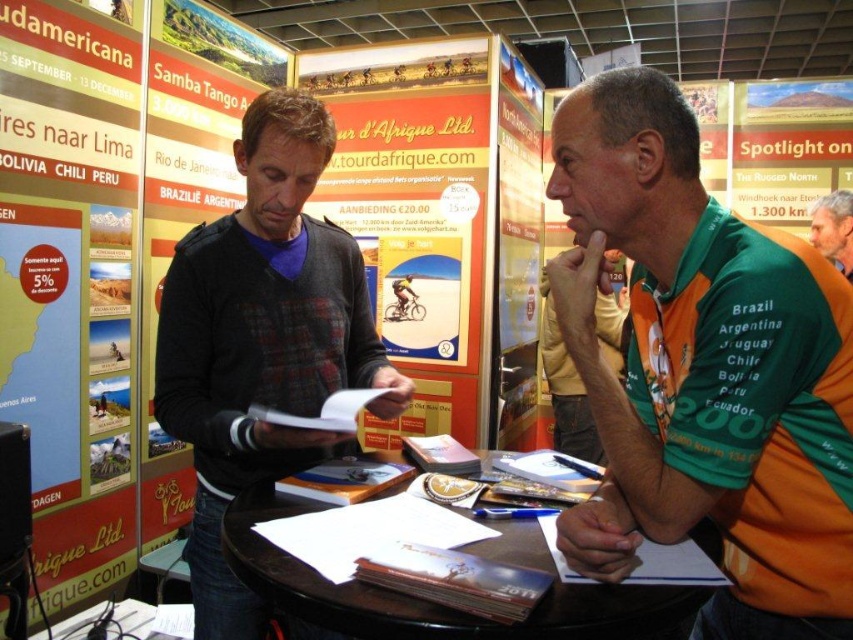
Question: From the image, what is the correct spatial relationship of green jersey at center in relation to green jersey at upper right?

Choices:
 (A) above
 (B) below

Answer: (B)

Question: Which object is farther from the camera taking this photo?

Choices:
 (A) dark gray sweater at center
 (B) green jersey at center

Answer: (A)

Question: In this image, where is dark gray sweater at center located relative to green jersey at right?

Choices:
 (A) below
 (B) above

Answer: (B)

Question: Which point is closer to the camera?

Choices:
 (A) (167, 406)
 (B) (543, 358)
 (C) (833, 211)
 (D) (755, 294)

Answer: (D)

Question: Which object is positioned farthest from the green jersey at upper right?

Choices:
 (A) dark gray sweater at center
 (B) green jersey at right

Answer: (A)

Question: Does green jersey at center appear on the left side of dark gray sweater at center?

Choices:
 (A) no
 (B) yes

Answer: (A)